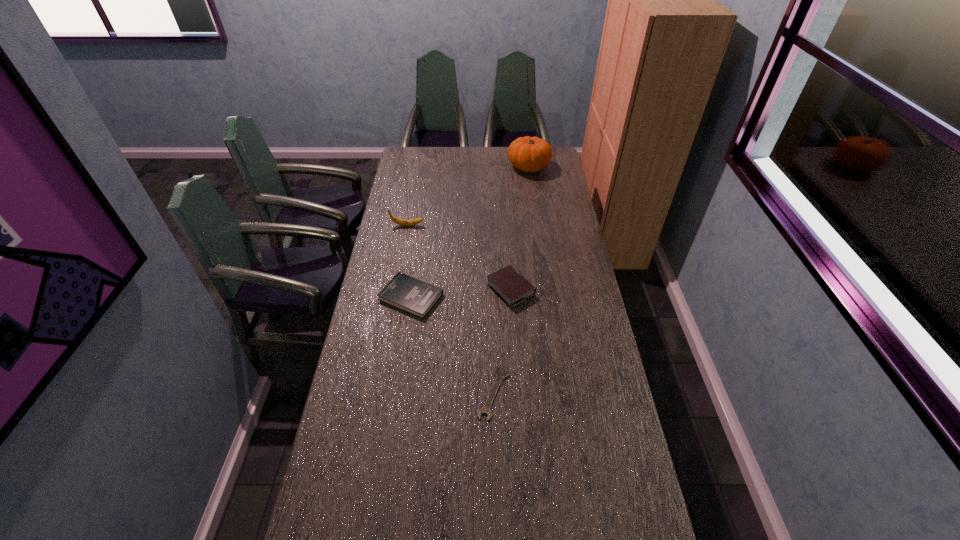
I want to click on vacant space at the right edge of the desktop, so click(554, 200).

Where is `vacant space at the far left corner of the desktop`? This screenshot has width=960, height=540. vacant space at the far left corner of the desktop is located at coordinates (424, 156).

Locate an element on the screen. The image size is (960, 540). free area in between the fourth tallest object and the tallest object is located at coordinates (469, 232).

Locate an element on the screen. The height and width of the screenshot is (540, 960). free space between the second farthest object and the second shortest object is located at coordinates (409, 261).

At what (x,y) coordinates should I click in order to perform the action: click on free space between the wrench and the Bible. Please return your answer as a coordinate pair (x, y). Image resolution: width=960 pixels, height=540 pixels. Looking at the image, I should click on [x=502, y=341].

The width and height of the screenshot is (960, 540). I want to click on free area in between the tallest object and the book, so click(469, 232).

You are a GUI agent. You are given a task and a screenshot of the screen. Output one action in this format:
    pyautogui.click(x=<x>, y=<y>)
    Task: Click on the free point between the fourth tallest object and the farthest object
    
    Given the screenshot: What is the action you would take?
    pyautogui.click(x=469, y=232)

Identify the location of blank region between the fourth shortest object and the shortest object. (450, 309).

Locate an element on the screen. This screenshot has width=960, height=540. empty space between the book and the third shortest object is located at coordinates (461, 293).

At what (x,y) coordinates should I click in order to perform the action: click on free space between the third tallest object and the wrench. Please return your answer as a coordinate pair (x, y). This screenshot has width=960, height=540. Looking at the image, I should click on point(502,341).